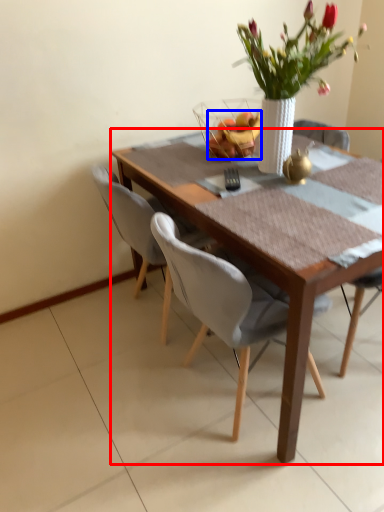
Question: Which point is closer to the camera, kitchen & dining room table (highlighted by a red box) or fruit (highlighted by a blue box)?

Choices:
 (A) kitchen & dining room table
 (B) fruit

Answer: (A)